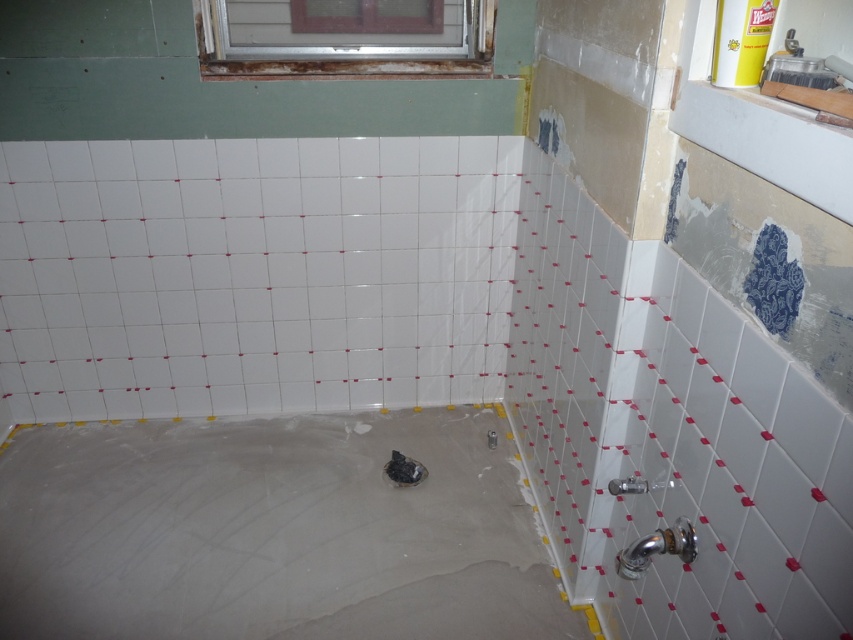
Who is more forward, [10,461] or [425,24]?

Point [425,24] is in front.

Does smooth concrete bathtub at lower left have a smaller size compared to metallic silver window at upper center?

Actually, smooth concrete bathtub at lower left might be larger than metallic silver window at upper center.

The image size is (853, 640). Describe the element at coordinates (273, 531) in the screenshot. I see `smooth concrete bathtub at lower left` at that location.

This screenshot has height=640, width=853. Identify the location of smooth concrete bathtub at lower left. (273, 531).